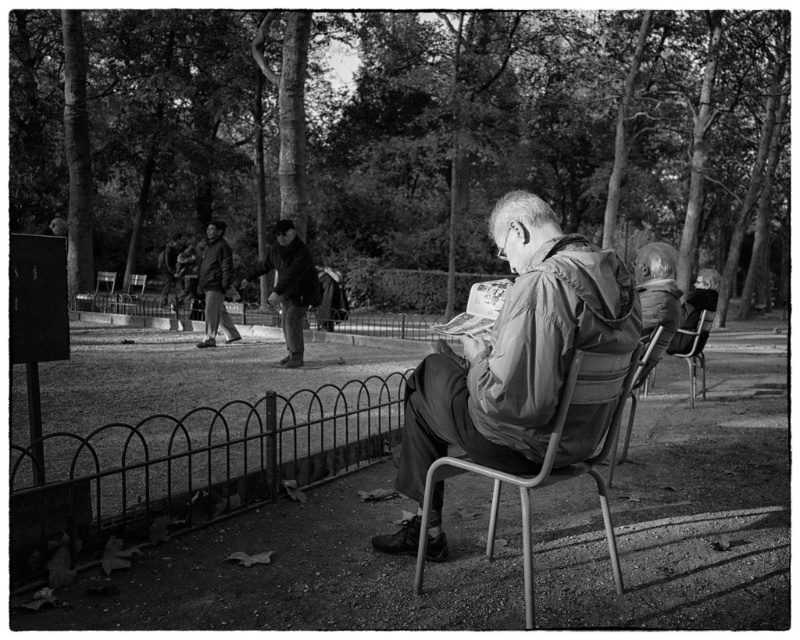
Question: Which point appears closest to the camera in this image?

Choices:
 (A) (268, 300)
 (B) (640, 365)
 (C) (76, 307)
 (D) (592, 282)

Answer: (D)

Question: Is metallic gray folding chair at center to the right of metallic gray chair at center from the viewer's perspective?

Choices:
 (A) no
 (B) yes

Answer: (A)

Question: Which point is closer to the camera?

Choices:
 (A) (608, 474)
 (B) (140, 282)
 (C) (424, 474)

Answer: (C)

Question: Which of the following is the closest to the observer?

Choices:
 (A) (692, 337)
 (B) (576, 371)
 (C) (228, 326)

Answer: (B)

Question: Can you confirm if dark gray jacket at center is bigger than metallic gray chair at center?

Choices:
 (A) no
 (B) yes

Answer: (A)

Question: Is matte gray jacket at center below metallic silver chair at lower left?

Choices:
 (A) yes
 (B) no

Answer: (A)